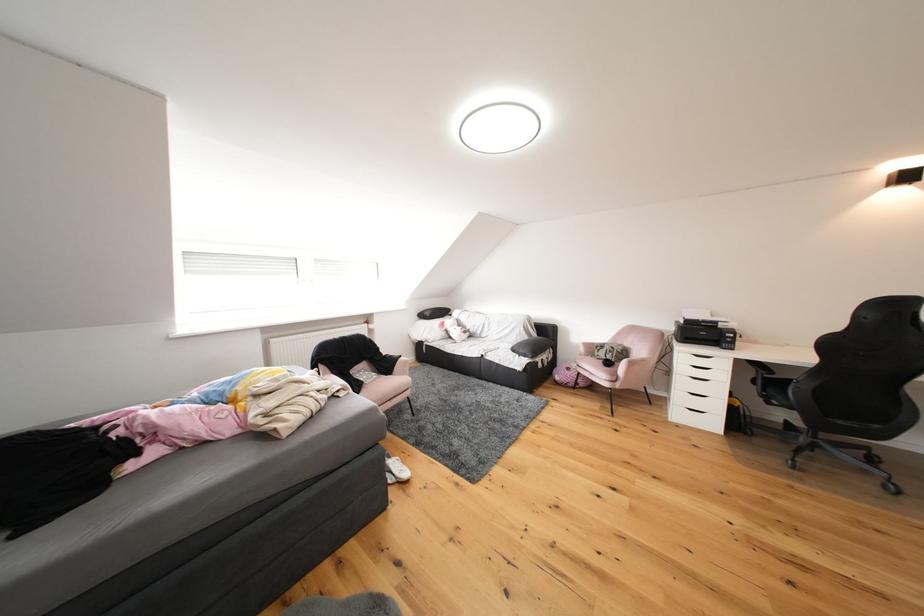
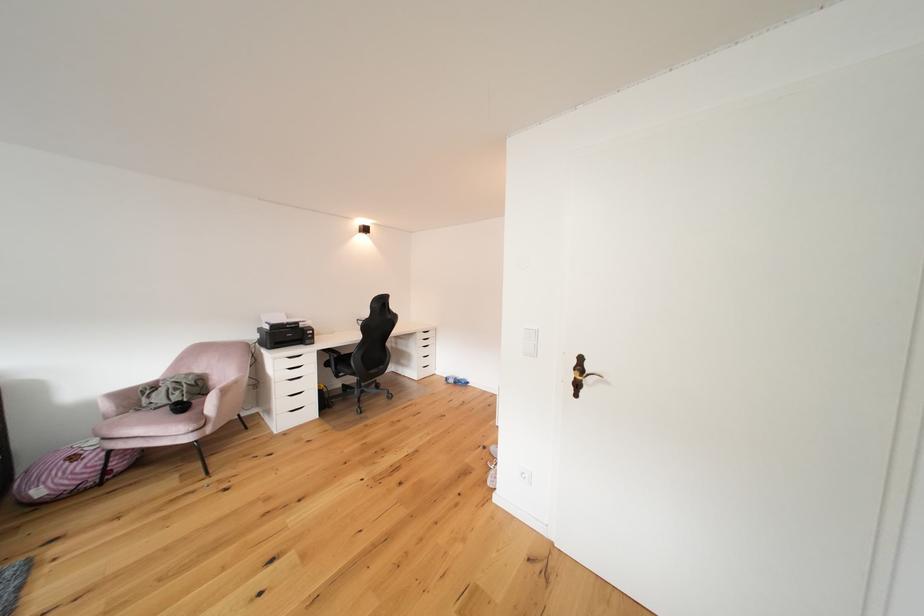
Where in the second image is the point corresponding to (x=617, y=368) from the first image?

(190, 411)